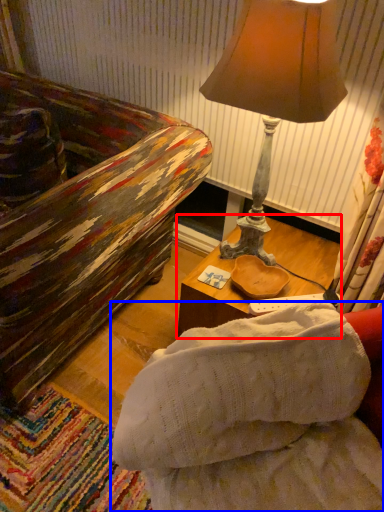
Question: Which object appears farthest to the camera in this image, table (highlighted by a red box) or studio couch (highlighted by a blue box)?

Choices:
 (A) table
 (B) studio couch

Answer: (A)